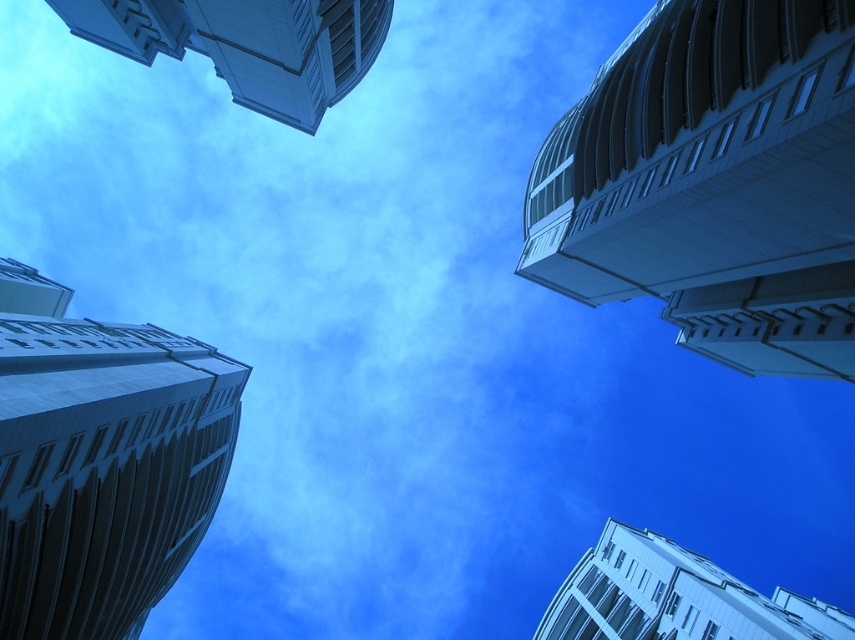
Between white smooth building at upper right and smooth white building at left, which one has more height?

Standing taller between the two is white smooth building at upper right.

Can you confirm if white smooth building at upper right is bigger than smooth white building at left?

No.

What do you see at coordinates (712, 182) in the screenshot?
I see `white smooth building at upper right` at bounding box center [712, 182].

Identify the location of white smooth building at upper right. The width and height of the screenshot is (855, 640). (712, 182).

Who is higher up, smooth white building at left or white glossy building at upper left?

white glossy building at upper left

Who is taller, smooth white building at left or white glossy building at upper left?

Standing taller between the two is smooth white building at left.

Find the location of a particular element. This screenshot has width=855, height=640. smooth white building at left is located at coordinates (101, 461).

Find the location of a particular element. Image resolution: width=855 pixels, height=640 pixels. smooth white building at left is located at coordinates (101, 461).

Is smooth white building at left closer to the viewer compared to white glossy building at upper right?

Yes, smooth white building at left is in front of white glossy building at upper right.

Between point (105, 540) and point (555, 612), which one is positioned behind?

Positioned behind is point (555, 612).

Where is `smooth white building at left`? The image size is (855, 640). smooth white building at left is located at coordinates point(101,461).